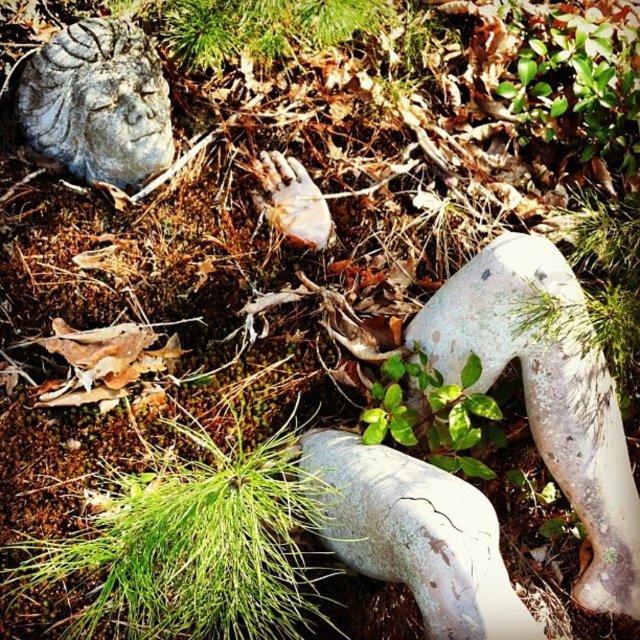
Can you confirm if cracked stone leg at center is bigger than green leafy plant at center?

Indeed, cracked stone leg at center has a larger size compared to green leafy plant at center.

Who is higher up, cracked stone leg at center or green leafy plant at center?

Positioned higher is green leafy plant at center.

You are a GUI agent. You are given a task and a screenshot of the screen. Output one action in this format:
    pyautogui.click(x=<x>, y=<y>)
    Task: Click on the cracked stone leg at center
    The width and height of the screenshot is (640, 640).
    Given the screenshot: What is the action you would take?
    pyautogui.click(x=417, y=536)

I want to click on cracked stone leg at center, so click(x=417, y=536).

Is green grass at lower left closer to camera compared to gray stone face at upper left?

Yes, green grass at lower left is closer to the viewer.

Is point (256, 552) farther from viewer compared to point (124, 22)?

That is False.

Find the location of a particular element. This screenshot has height=640, width=640. green grass at lower left is located at coordinates (195, 550).

Is green leafy plant at upper right taller than green leafy plant at center?

Correct, green leafy plant at upper right is much taller as green leafy plant at center.

Which is above, green leafy plant at upper right or green leafy plant at center?

Positioned higher is green leafy plant at upper right.

Which is in front, point (572, 24) or point (406, 429)?

Point (406, 429)

Image resolution: width=640 pixels, height=640 pixels. Find the location of `green leafy plant at upper right`. green leafy plant at upper right is located at coordinates (579, 77).